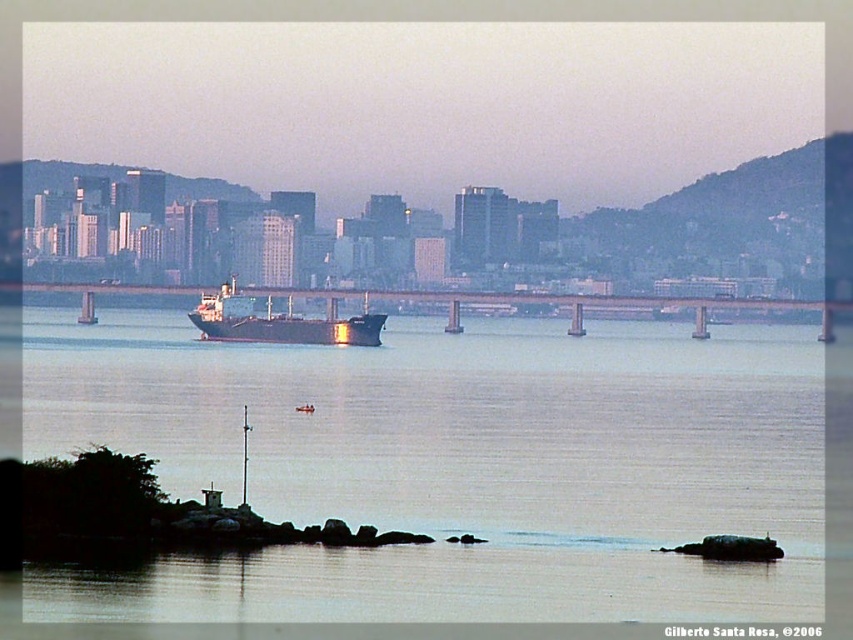
You are a pilot preparing to land a plane on the smooth water at center. The runway is the metal bridge at center. Can your plane land safely on the runway?

The smooth water at center is taller than the metal bridge at center, so the plane cannot land safely on the runway because the water is higher than the bridge.

You are a pilot flying a small airplane that needs to pass under the metal bridge at center. The airplane has a wingspan of 12 meters. Can you safely fly under the bridge without hitting the shiny black ship at center?

The metal bridge at center has a lesser height compared to the shiny black ship at center. Since the ship is taller than the bridge, the airplane must ensure it stays below the bridge but above the ship. However, without knowing the exact clearance height of the bridge, it is impossible to determine if the 12 meter wingspan airplane can safely pass under the bridge without hitting the ship.